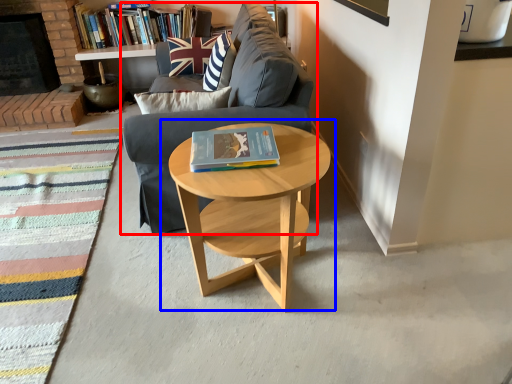
Question: Among these objects, which one is farthest to the camera, studio couch (highlighted by a red box) or coffee table (highlighted by a blue box)?

Choices:
 (A) studio couch
 (B) coffee table

Answer: (A)